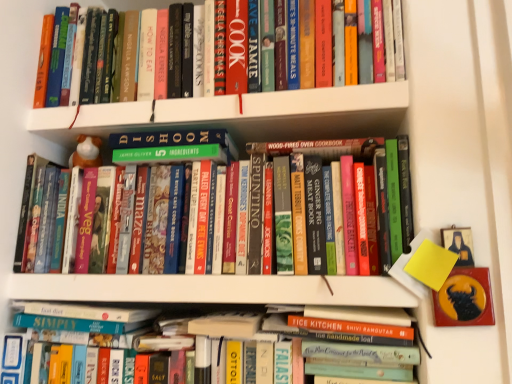
Question: Can you confirm if hardcover books at upper center, which appears as the third book when ordered from the bottom, is smaller than white glossy bookshelf at upper center?

Choices:
 (A) no
 (B) yes

Answer: (A)

Question: Can you confirm if hardcover books at upper center, which appears as the third book when ordered from the bottom, is thinner than white glossy bookshelf at upper center?

Choices:
 (A) yes
 (B) no

Answer: (A)

Question: Considering the relative sizes of hardcover books at upper center, which appears as the third book when ordered from the bottom, and white glossy bookshelf at upper center in the image provided, is hardcover books at upper center, which appears as the third book when ordered from the bottom, wider than white glossy bookshelf at upper center?

Choices:
 (A) no
 (B) yes

Answer: (A)

Question: Is hardcover books at upper center, the first book in the top-to-bottom sequence, next to white glossy bookshelf at upper center?

Choices:
 (A) no
 (B) yes

Answer: (B)

Question: Is hardcover books at upper center, which appears as the third book when ordered from the bottom, looking in the opposite direction of white glossy bookshelf at upper center?

Choices:
 (A) no
 (B) yes

Answer: (A)

Question: Considering the relative sizes of hardcover books at upper center, which appears as the third book when ordered from the bottom, and white glossy bookshelf at upper center in the image provided, is hardcover books at upper center, which appears as the third book when ordered from the bottom, bigger than white glossy bookshelf at upper center?

Choices:
 (A) no
 (B) yes

Answer: (B)

Question: Is hardcover book at lower center, positioned as the third book in top-to-bottom order, positioned far away from hardcover books at center, which is the second book from top to bottom?

Choices:
 (A) yes
 (B) no

Answer: (B)

Question: Does hardcover book at lower center, which is counted as the first book, starting from the bottom, appear on the right side of hardcover books at center, the 2th book positioned from the bottom?

Choices:
 (A) no
 (B) yes

Answer: (A)

Question: Is hardcover book at lower center, positioned as the third book in top-to-bottom order, positioned beyond the bounds of hardcover books at center, which is the second book from top to bottom?

Choices:
 (A) yes
 (B) no

Answer: (A)

Question: Would you say hardcover books at center, which is the second book from top to bottom, is part of hardcover book at lower center, which is counted as the first book, starting from the bottom,'s contents?

Choices:
 (A) yes
 (B) no

Answer: (B)

Question: Is hardcover book at lower center, which is counted as the first book, starting from the bottom, directly adjacent to hardcover books at center, the 2th book positioned from the bottom?

Choices:
 (A) no
 (B) yes

Answer: (A)

Question: Is hardcover book at lower center, positioned as the third book in top-to-bottom order, to the left of hardcover books at center, the 2th book positioned from the bottom, from the viewer's perspective?

Choices:
 (A) yes
 (B) no

Answer: (A)

Question: From the image's perspective, is hardcover books at center, the 2th book positioned from the bottom, over white glossy bookshelf at upper center?

Choices:
 (A) yes
 (B) no

Answer: (B)